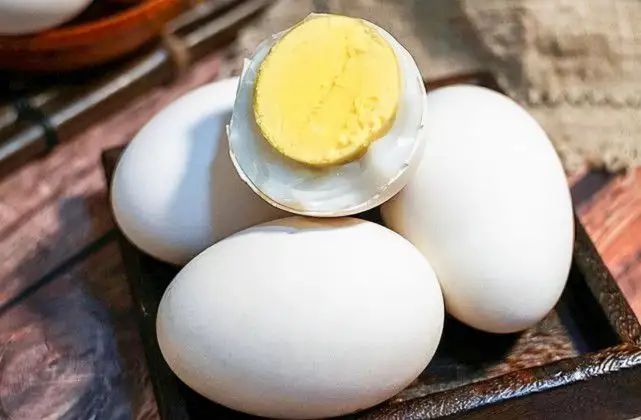
The height and width of the screenshot is (420, 641). What are the coordinates of `wood floor` in the screenshot? It's located at tap(90, 307).